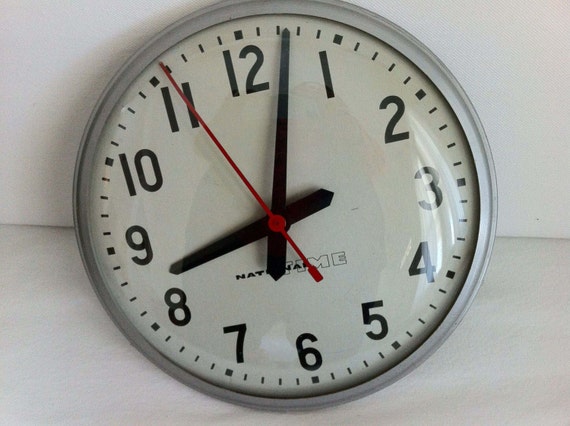
This screenshot has width=570, height=426. I want to click on edge of the clock, so click(x=490, y=239).